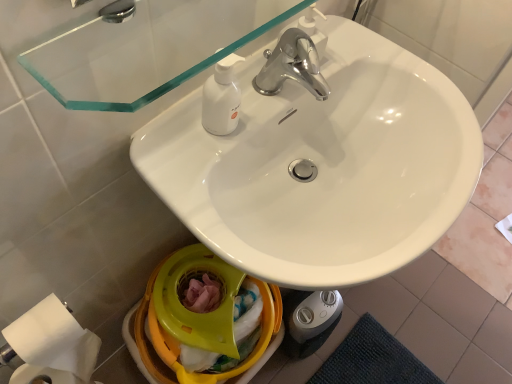
Describe the element at coordinates (322, 166) in the screenshot. I see `white glossy sink at center` at that location.

This screenshot has width=512, height=384. What do you see at coordinates (147, 51) in the screenshot? I see `transparent glass mirror at upper center` at bounding box center [147, 51].

Find the location of `white matte toilet paper at lower left`. white matte toilet paper at lower left is located at coordinates (52, 343).

Identify the location of yellow plastic bidet at lower center. (196, 319).

This screenshot has height=384, width=512. In order to click on white glossy sink at center in this screenshot , I will do `click(322, 166)`.

Is yellow plastic bidet at lower center facing away from transparent glass mirror at upper center?

No, yellow plastic bidet at lower center is not facing away from transparent glass mirror at upper center.

Which of these two, yellow plastic bidet at lower center or transparent glass mirror at upper center, stands shorter?

transparent glass mirror at upper center.

Is transparent glass mirror at upper center completely or partially inside yellow plastic bidet at lower center?

No, transparent glass mirror at upper center is not surrounded by yellow plastic bidet at lower center.

The image size is (512, 384). What are the coordinates of `toilet paper that is on the left side of white glossy sink at center` in the screenshot? It's located at (52, 343).

Looking at this image, from a real-world perspective, is white glossy sink at center located higher than white matte toilet paper at lower left?

Yes, from a real-world perspective, white glossy sink at center is on top of white matte toilet paper at lower left.

Which is correct: white glossy sink at center is inside white matte toilet paper at lower left, or outside of it?

The correct answer is: outside.

Is white glossy sink at center positioned behind white matte toilet paper at lower left?

No, white glossy sink at center is closer to the viewer.

From the image's perspective, is white matte toilet paper at lower left under white glossy sink at center?

Yes, from the image's perspective, white matte toilet paper at lower left is below white glossy sink at center.

Based on their sizes in the image, would you say white matte toilet paper at lower left is bigger or smaller than white glossy sink at center?

white matte toilet paper at lower left is smaller than white glossy sink at center.

Based on their positions, is white matte toilet paper at lower left located to the left or right of white glossy sink at center?

Based on their positions, white matte toilet paper at lower left is located to the left of white glossy sink at center.

Is white matte toilet paper at lower left taller than white glossy sink at center?

Correct, white matte toilet paper at lower left is much taller as white glossy sink at center.

Is white matte toilet paper at lower left surrounding yellow plastic bidet at lower center?

Definitely not — yellow plastic bidet at lower center is not inside white matte toilet paper at lower left.

Is white matte toilet paper at lower left next to yellow plastic bidet at lower center?

No, white matte toilet paper at lower left is not next to yellow plastic bidet at lower center.

Considering the positions of objects white matte toilet paper at lower left and yellow plastic bidet at lower center in the image provided, who is more to the right, white matte toilet paper at lower left or yellow plastic bidet at lower center?

Positioned to the right is yellow plastic bidet at lower center.

Considering their positions, is white matte toilet paper at lower left located in front of or behind yellow plastic bidet at lower center?

Clearly, white matte toilet paper at lower left is in front of yellow plastic bidet at lower center.

Considering their positions, is white glossy sink at center located in front of or behind yellow plastic bidet at lower center?

white glossy sink at center is in front of yellow plastic bidet at lower center.

This screenshot has height=384, width=512. I want to click on sink on the right of yellow plastic bidet at lower center, so click(322, 166).

From a real-world perspective, which is physically below, white glossy sink at center or yellow plastic bidet at lower center?

yellow plastic bidet at lower center is physically lower.

From the image's perspective, does white glossy sink at center appear higher than yellow plastic bidet at lower center?

Yes, from the image's perspective, white glossy sink at center is over yellow plastic bidet at lower center.

Which of these two, transparent glass mirror at upper center or white glossy sink at center, stands taller?

white glossy sink at center is taller.

Is transparent glass mirror at upper center positioned with its back to white glossy sink at center?

No, transparent glass mirror at upper center is not facing the opposite direction of white glossy sink at center.

Does point (209, 21) come closer to viewer compared to point (407, 222)?

That is True.

This screenshot has height=384, width=512. What are the coordinates of `sink below the transparent glass mirror at upper center (from a real-world perspective)` in the screenshot? It's located at pos(322,166).

Measure the distance between transparent glass mirror at upper center and yellow plastic bidet at lower center.

22.39 inches.

From the image's perspective, is transparent glass mirror at upper center beneath yellow plastic bidet at lower center?

No.

Image resolution: width=512 pixels, height=384 pixels. I want to click on bidet on the left of transparent glass mirror at upper center, so click(196, 319).

Considering the positions of objects transparent glass mirror at upper center and yellow plastic bidet at lower center in the image provided, who is more to the right, transparent glass mirror at upper center or yellow plastic bidet at lower center?

transparent glass mirror at upper center is more to the right.

Where is `bidet lying on the left of transparent glass mirror at upper center`? bidet lying on the left of transparent glass mirror at upper center is located at coordinates [196, 319].

Locate an element on the screen. This screenshot has width=512, height=384. toilet paper below the white glossy sink at center (from the image's perspective) is located at coordinates tap(52, 343).

From the image, which object appears to be nearer to transparent glass mirror at upper center, yellow plastic bidet at lower center or white matte toilet paper at lower left?

white matte toilet paper at lower left is positioned closer to the anchor transparent glass mirror at upper center.

From the image, which object appears to be nearer to white matte toilet paper at lower left, white glossy sink at center or transparent glass mirror at upper center?

The object closer to white matte toilet paper at lower left is transparent glass mirror at upper center.

Looking at the image, which one is located further to white glossy sink at center, transparent glass mirror at upper center or yellow plastic bidet at lower center?

yellow plastic bidet at lower center is further to white glossy sink at center.

Considering their positions, is white glossy sink at center positioned closer to transparent glass mirror at upper center than yellow plastic bidet at lower center?

white glossy sink at center lies closer to transparent glass mirror at upper center than the other object.

Considering their positions, is white matte toilet paper at lower left positioned further to yellow plastic bidet at lower center than transparent glass mirror at upper center?

transparent glass mirror at upper center lies further to yellow plastic bidet at lower center than the other object.

Estimate the real-world distances between objects in this image. Which object is further from transparent glass mirror at upper center, white matte toilet paper at lower left or white glossy sink at center?

white matte toilet paper at lower left.

Based on their spatial positions, is white glossy sink at center or transparent glass mirror at upper center closer to yellow plastic bidet at lower center?

white glossy sink at center.

Based on their spatial positions, is white matte toilet paper at lower left or transparent glass mirror at upper center closer to white glossy sink at center?

transparent glass mirror at upper center is closer to white glossy sink at center.

Where is `sink between transparent glass mirror at upper center and yellow plastic bidet at lower center in the up-down direction`? The height and width of the screenshot is (384, 512). sink between transparent glass mirror at upper center and yellow plastic bidet at lower center in the up-down direction is located at coordinates (322, 166).

Identify the location of bidet situated between white matte toilet paper at lower left and white glossy sink at center from left to right. (196, 319).

I want to click on mirror between white matte toilet paper at lower left and white glossy sink at center, so click(x=147, y=51).

You are a GUI agent. You are given a task and a screenshot of the screen. Output one action in this format:
    pyautogui.click(x=<x>, y=<y>)
    Task: Click on the toilet paper between transparent glass mirror at upper center and yellow plastic bidet at lower center in the up-down direction
    The width and height of the screenshot is (512, 384).
    Given the screenshot: What is the action you would take?
    pyautogui.click(x=52, y=343)